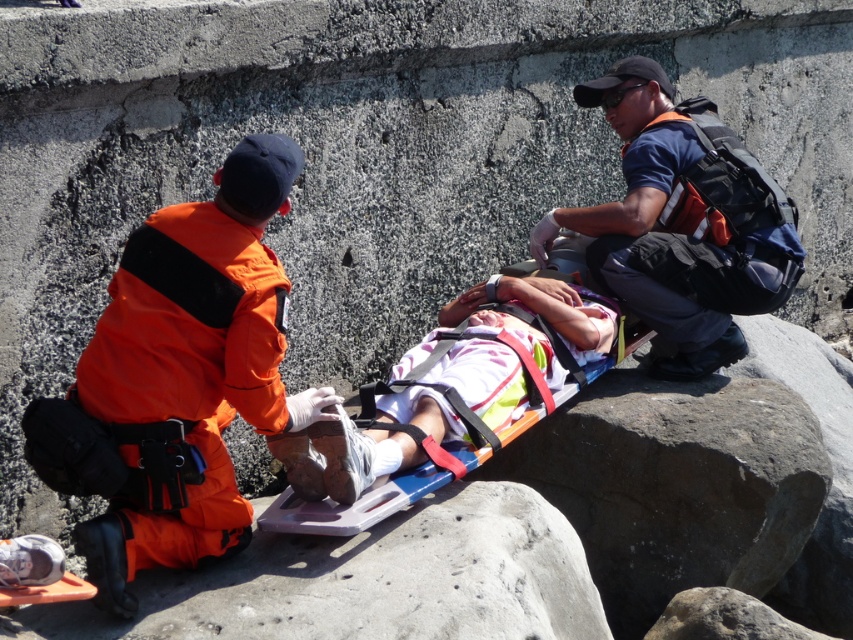
Question: Which of these objects is positioned farthest from the orange fabric uniform at left?

Choices:
 (A) blue fabric backpack at upper right
 (B) plastic stretcher at center

Answer: (A)

Question: Can you confirm if blue fabric backpack at upper right is positioned to the left of plastic stretcher at center?

Choices:
 (A) yes
 (B) no

Answer: (B)

Question: Can you confirm if orange fabric uniform at left is bigger than plastic stretcher at center?

Choices:
 (A) no
 (B) yes

Answer: (A)

Question: Is blue fabric backpack at upper right wider than plastic stretcher at center?

Choices:
 (A) no
 (B) yes

Answer: (A)

Question: Estimate the real-world distances between objects in this image. Which object is farther from the blue fabric backpack at upper right?

Choices:
 (A) orange fabric uniform at left
 (B) plastic stretcher at center

Answer: (A)

Question: Which point appears closest to the camera in this image?

Choices:
 (A) (660, 212)
 (B) (126, 570)
 (C) (380, 480)

Answer: (B)